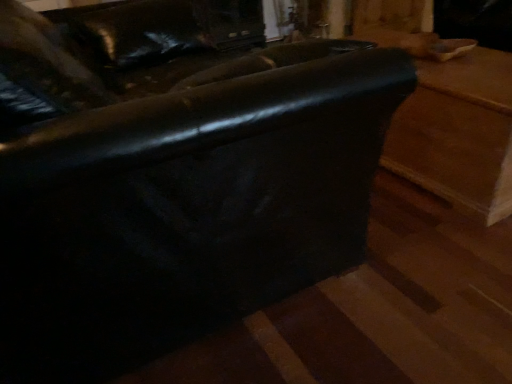
I want to click on wooden chest at right, so click(454, 126).

The image size is (512, 384). Describe the element at coordinates (454, 126) in the screenshot. I see `wooden chest at right` at that location.

At what (x,y) coordinates should I click in order to perform the action: click on wooden chest at right. Please return your answer as a coordinate pair (x, y). Looking at the image, I should click on (454, 126).